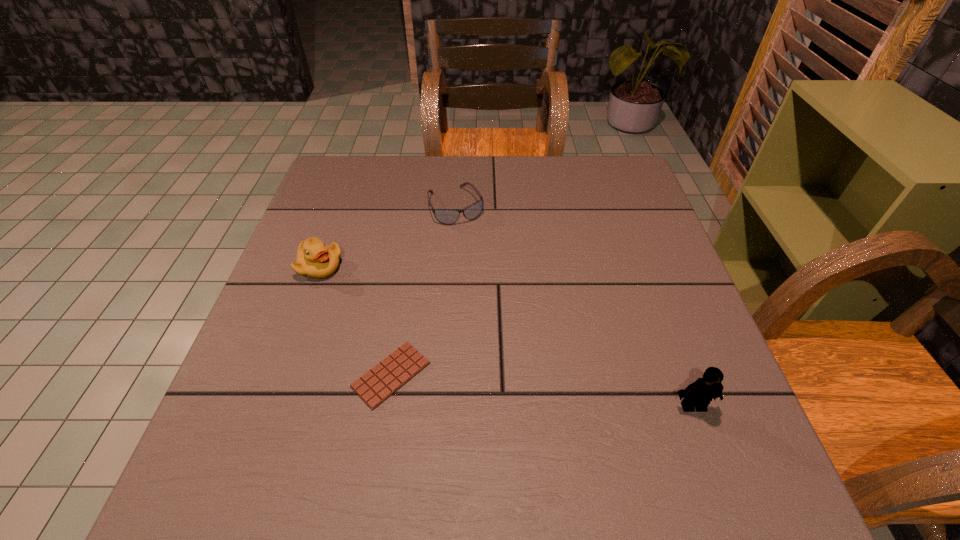
At what (x,y) coordinates should I click in order to perform the action: click on free spot located on the front-facing side of the leftmost object. Please return your answer as a coordinate pair (x, y). This screenshot has height=540, width=960. Looking at the image, I should click on (463, 357).

Find the location of a particular element. The width and height of the screenshot is (960, 540). blank area located on the lenses of the farthest object is located at coordinates (517, 328).

At what (x,y) coordinates should I click in order to perform the action: click on vacant space situated 0.190m on the lenses of the farthest object. Please return your answer as a coordinate pair (x, y). This screenshot has height=540, width=960. Looking at the image, I should click on coord(490,275).

This screenshot has width=960, height=540. What are the coordinates of `vacant space located 0.110m on the lenses of the farthest object` in the screenshot? It's located at [x=478, y=252].

The height and width of the screenshot is (540, 960). What are the coordinates of `object that is at the far edge` in the screenshot? It's located at (445, 216).

Identify the location of candy bar present at the near edge. (384, 379).

Find the location of a particular element. The image size is (960, 540). Lego that is at the near edge is located at coordinates coord(698,394).

At what (x,y) coordinates should I click in order to perform the action: click on object at the left edge. Please return your answer as a coordinate pair (x, y). This screenshot has width=960, height=540. Looking at the image, I should click on (315, 259).

Where is `object that is at the right edge`? object that is at the right edge is located at coordinates (698, 394).

Locate an element on the screen. Image resolution: width=960 pixels, height=540 pixels. object that is at the near right corner is located at coordinates (698, 394).